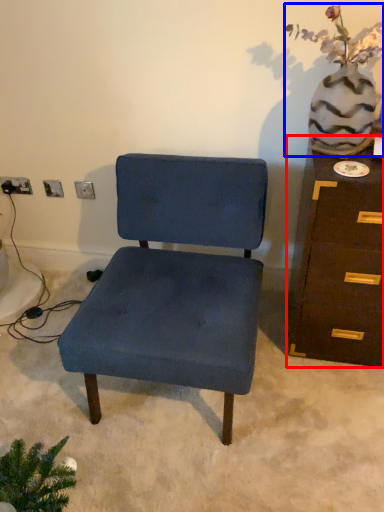
Question: Which object is further to the camera taking this photo, chest of drawers (highlighted by a red box) or floral arrangement (highlighted by a blue box)?

Choices:
 (A) chest of drawers
 (B) floral arrangement

Answer: (A)